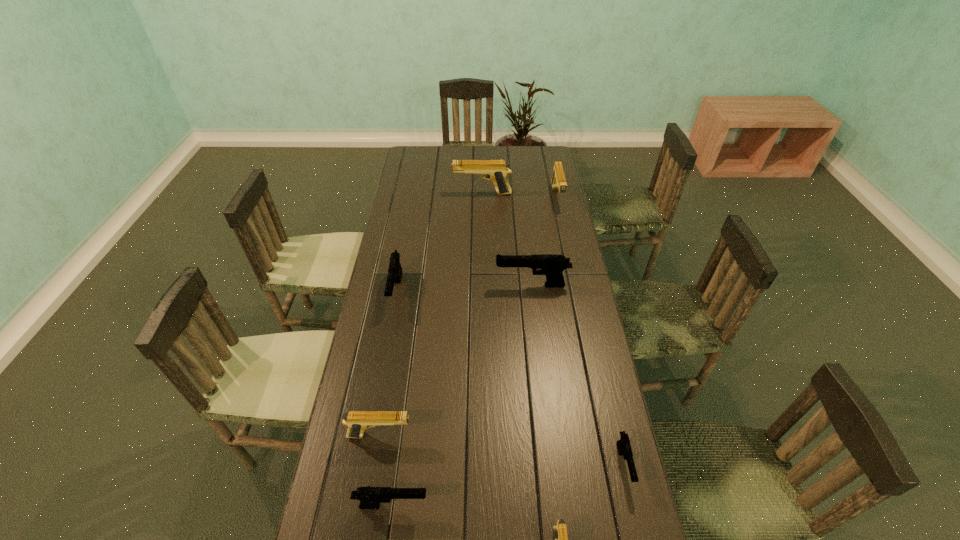
Image resolution: width=960 pixels, height=540 pixels. What are the coordinates of `the second tan pistol from left to right` in the screenshot? It's located at (496, 170).

At what (x,y) coordinates should I click in order to perform the action: click on the third black pistol from left to right. Please return your answer as a coordinate pair (x, y). Looking at the image, I should click on pos(551,265).

Where is `the second biggest tan pistol`? the second biggest tan pistol is located at coordinates (558, 181).

Where is `the seventh pistol from left to right`? The width and height of the screenshot is (960, 540). the seventh pistol from left to right is located at coordinates (558, 181).

Identify the location of the third smallest black pistol. (395, 270).

The image size is (960, 540). I want to click on the fifth farthest pistol, so click(357, 421).

Find the location of a particular element. Image resolution: width=960 pixels, height=540 pixels. the fourth nearest object is located at coordinates (357, 421).

In order to click on the second nearest pistol in this screenshot , I will do `click(370, 497)`.

Find the location of `the third biggest black pistol`. the third biggest black pistol is located at coordinates (370, 497).

Where is `the second nearest black pistol`? the second nearest black pistol is located at coordinates (624, 447).